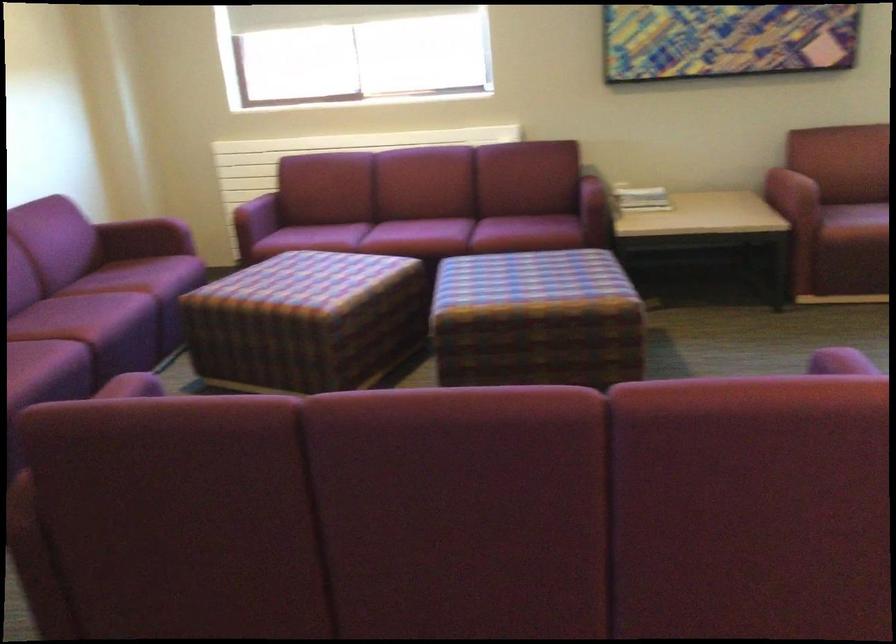
Describe the element at coordinates (445, 236) in the screenshot. The height and width of the screenshot is (644, 896). I see `a red sofa sitting surface` at that location.